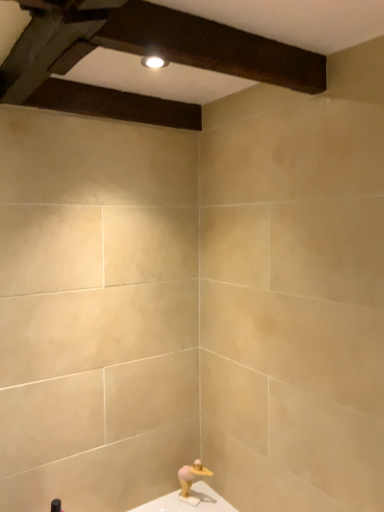
Question: Is pink matte sculpture at lower center wider or thinner than dark brown wood at upper center?

Choices:
 (A) thin
 (B) wide

Answer: (A)

Question: Visually, is pink matte sculpture at lower center positioned to the left or to the right of dark brown wood at upper center?

Choices:
 (A) left
 (B) right

Answer: (B)

Question: From a real-world perspective, relative to dark brown wood at upper center, is pink matte sculpture at lower center vertically above or below?

Choices:
 (A) above
 (B) below

Answer: (B)

Question: Considering the positions of dark brown wood at upper center and pink matte sculpture at lower center in the image, is dark brown wood at upper center taller or shorter than pink matte sculpture at lower center?

Choices:
 (A) short
 (B) tall

Answer: (A)

Question: Which is correct: dark brown wood at upper center is inside pink matte sculpture at lower center, or outside of it?

Choices:
 (A) inside
 (B) outside

Answer: (B)

Question: Is point (59, 87) positioned closer to the camera than point (183, 492)?

Choices:
 (A) closer
 (B) farther

Answer: (A)

Question: From a real-world perspective, is dark brown wood at upper center physically located above or below pink matte sculpture at lower center?

Choices:
 (A) above
 (B) below

Answer: (A)